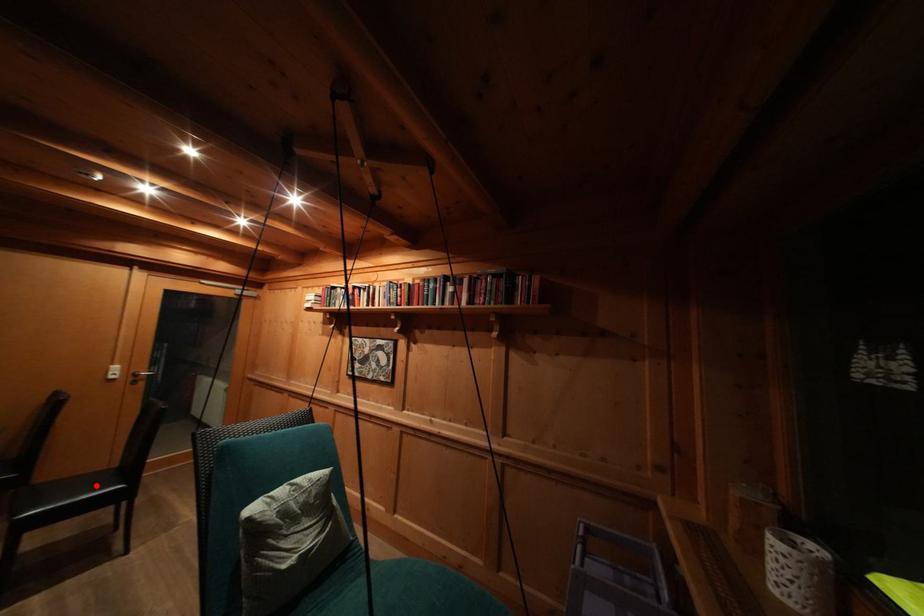
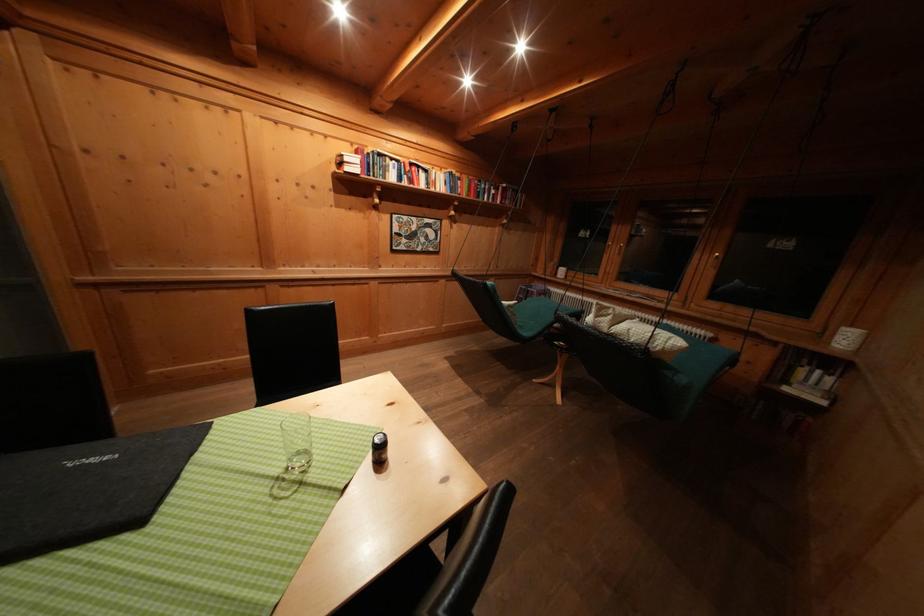
Question: I am providing you with two images of the same scene from different viewpoints. A red point is marked on the first image. Can you still see the location of the red point in image 2?

Choices:
 (A) Yes
 (B) No

Answer: (B)